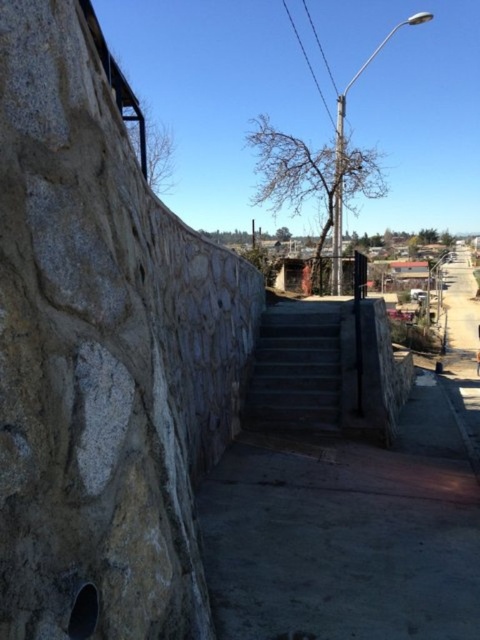
Which is in front, point (17, 461) or point (267, 330)?

Point (17, 461) is more forward.

Which is behind, point (44, 195) or point (252, 394)?

The point (252, 394) is behind.

What do you see at coordinates (101, 355) in the screenshot? I see `natural stone wall at left` at bounding box center [101, 355].

Where is `natural stone wall at left`? This screenshot has height=640, width=480. natural stone wall at left is located at coordinates (101, 355).